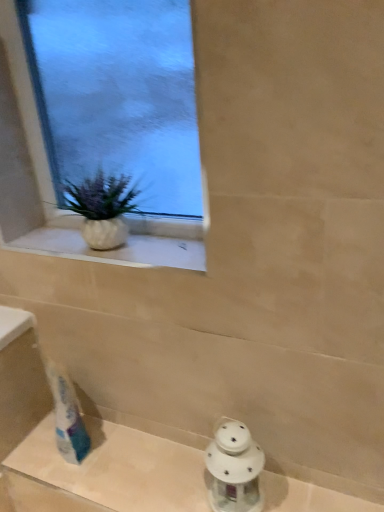
I want to click on vacant area located to the right-hand side of white porcelain lantern at lower right, so click(x=305, y=494).